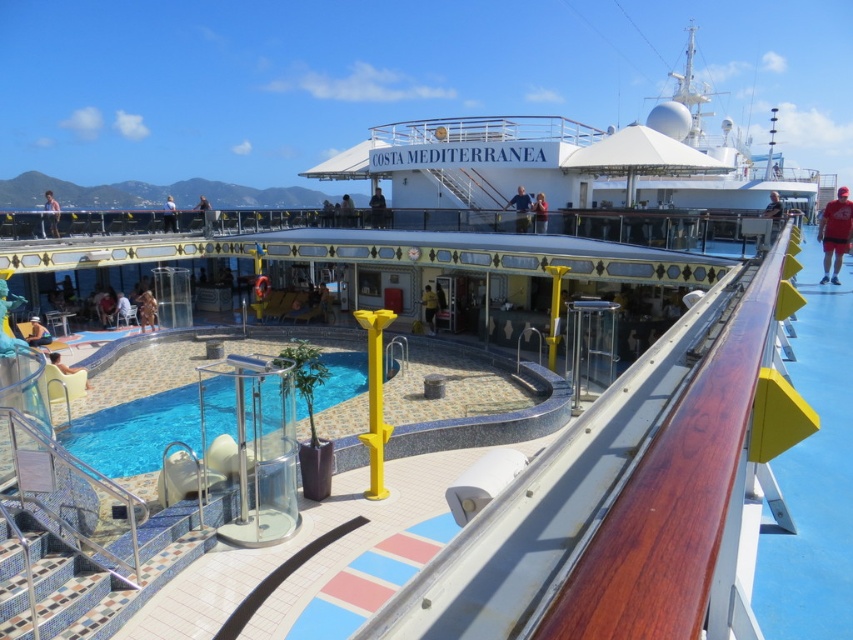
You are standing on the deck of the Costa Mediterranea and want to take a photo of the transparent glass pool at center and the matte black person at upper left. Which object will appear larger in your photo?

The transparent glass pool at center will appear larger in the photo because it is closer to the viewer than the matte black person at upper left.